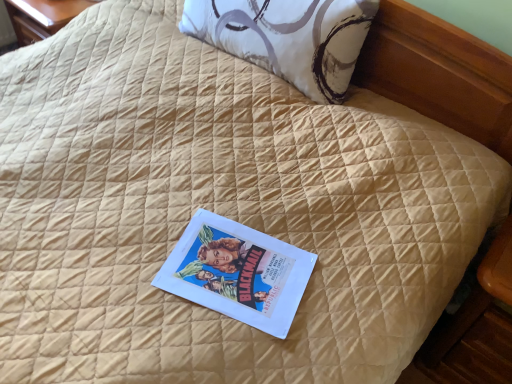
Question: Would you say white printed pillow at upper center is to the left or to the right of matte paper book at center in the picture?

Choices:
 (A) right
 (B) left

Answer: (A)

Question: Considering the positions of point (329, 23) and point (288, 322), is point (329, 23) closer or farther from the camera than point (288, 322)?

Choices:
 (A) farther
 (B) closer

Answer: (A)

Question: From a real-world perspective, is white printed pillow at upper center above or below matte paper book at center?

Choices:
 (A) above
 (B) below

Answer: (A)

Question: Considering the positions of point (253, 281) and point (286, 44), is point (253, 281) closer or farther from the camera than point (286, 44)?

Choices:
 (A) closer
 (B) farther

Answer: (A)

Question: From the image's perspective, is matte paper book at center located above or below white printed pillow at upper center?

Choices:
 (A) below
 (B) above

Answer: (A)

Question: Based on their positions, is matte paper book at center located to the left or right of white printed pillow at upper center?

Choices:
 (A) left
 (B) right

Answer: (A)

Question: Considering their positions, is matte paper book at center located in front of or behind white printed pillow at upper center?

Choices:
 (A) front
 (B) behind

Answer: (A)